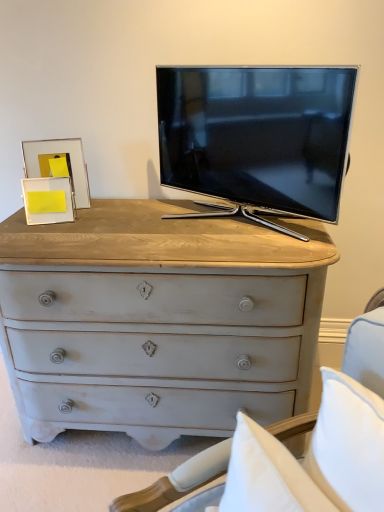
Question: Should I look upward or downward to see yellow paper at left, the second picture frame viewed from the back?

Choices:
 (A) up
 (B) down

Answer: (A)

Question: Is yellow paper at left, which ranks as the 1th picture frame in front-to-back order, positioned far away from gold metallic picture frame at upper left, which is counted as the 1th picture frame, starting from the back?

Choices:
 (A) yes
 (B) no

Answer: (B)

Question: Considering the relative sizes of yellow paper at left, the second picture frame viewed from the back, and gold metallic picture frame at upper left, arranged as the second picture frame when viewed from the front, in the image provided, is yellow paper at left, the second picture frame viewed from the back, smaller than gold metallic picture frame at upper left, arranged as the second picture frame when viewed from the front,?

Choices:
 (A) no
 (B) yes

Answer: (B)

Question: From a real-world perspective, is yellow paper at left, which ranks as the 1th picture frame in front-to-back order, below gold metallic picture frame at upper left, arranged as the second picture frame when viewed from the front?

Choices:
 (A) no
 (B) yes

Answer: (B)

Question: Is yellow paper at left, which ranks as the 1th picture frame in front-to-back order, positioned with its back to gold metallic picture frame at upper left, which is counted as the 1th picture frame, starting from the back?

Choices:
 (A) no
 (B) yes

Answer: (B)

Question: Does yellow paper at left, which ranks as the 1th picture frame in front-to-back order, appear on the right side of gold metallic picture frame at upper left, which is counted as the 1th picture frame, starting from the back?

Choices:
 (A) no
 (B) yes

Answer: (B)

Question: Does yellow paper at left, the second picture frame viewed from the back, come behind gold metallic picture frame at upper left, which is counted as the 1th picture frame, starting from the back?

Choices:
 (A) no
 (B) yes

Answer: (A)

Question: Can you confirm if distressed white chest of drawers at center is bigger than gold metallic picture frame at upper left, arranged as the second picture frame when viewed from the front?

Choices:
 (A) yes
 (B) no

Answer: (A)

Question: Is distressed white chest of drawers at center far away from gold metallic picture frame at upper left, which is counted as the 1th picture frame, starting from the back?

Choices:
 (A) no
 (B) yes

Answer: (A)

Question: Is distressed white chest of drawers at center surrounding gold metallic picture frame at upper left, which is counted as the 1th picture frame, starting from the back?

Choices:
 (A) yes
 (B) no

Answer: (B)

Question: From the image's perspective, is distressed white chest of drawers at center below gold metallic picture frame at upper left, arranged as the second picture frame when viewed from the front?

Choices:
 (A) no
 (B) yes

Answer: (B)

Question: From a real-world perspective, is distressed white chest of drawers at center on gold metallic picture frame at upper left, which is counted as the 1th picture frame, starting from the back?

Choices:
 (A) yes
 (B) no

Answer: (B)

Question: Does distressed white chest of drawers at center turn towards gold metallic picture frame at upper left, arranged as the second picture frame when viewed from the front?

Choices:
 (A) yes
 (B) no

Answer: (B)

Question: Is gold metallic picture frame at upper left, arranged as the second picture frame when viewed from the front, directly adjacent to distressed white chest of drawers at center?

Choices:
 (A) no
 (B) yes

Answer: (A)